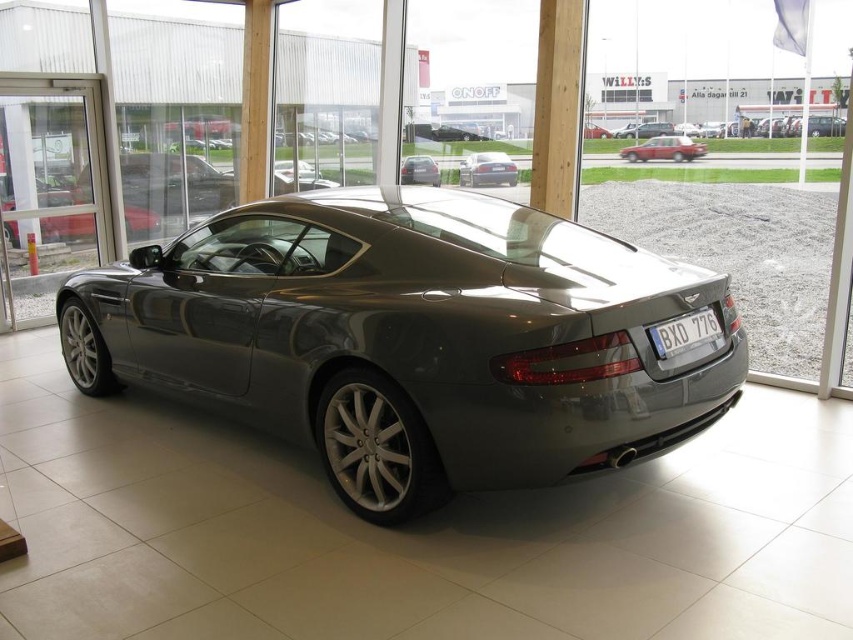
Question: Among these points, which one is farthest from the camera?

Choices:
 (A) (512, 182)
 (B) (206, 358)
 (C) (436, 177)

Answer: (C)

Question: Where is white plastic license plate at rear located in relation to satin silver sedan at center in the image?

Choices:
 (A) left
 (B) right

Answer: (B)

Question: Which of the following is the closest to the observer?

Choices:
 (A) metallic red sedan at center
 (B) satin black sedan at center
 (C) white plastic license plate at rear
 (D) satin metallic car at center

Answer: (D)

Question: Where is metallic red sedan at center located in relation to satin black sedan at center in the image?

Choices:
 (A) right
 (B) left

Answer: (A)

Question: Is white plastic license plate at rear in front of satin silver sedan at center?

Choices:
 (A) yes
 (B) no

Answer: (A)

Question: Which of the following is the farthest from the observer?

Choices:
 (A) (463, 163)
 (B) (664, 330)

Answer: (A)